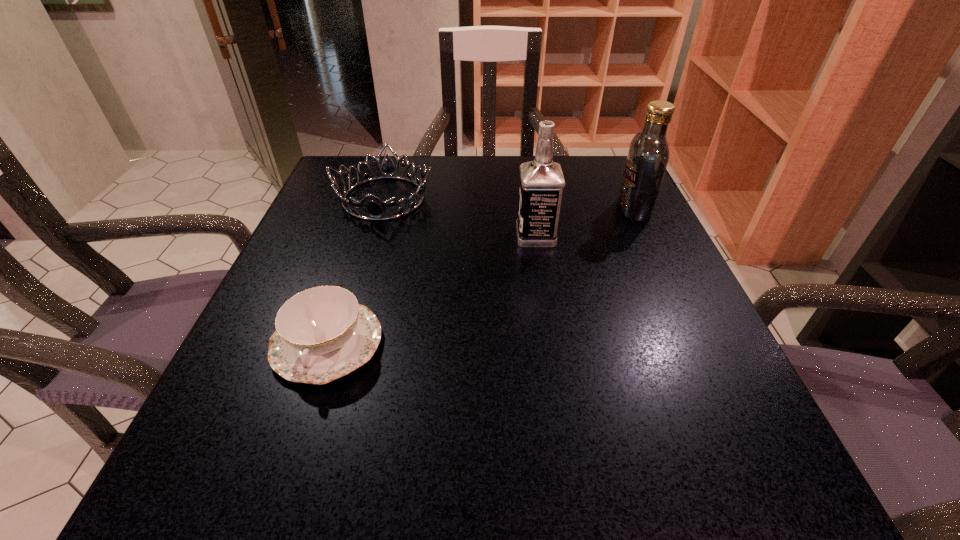
Locate an element on the screen. Image resolution: width=960 pixels, height=540 pixels. the left vodka is located at coordinates (541, 183).

This screenshot has height=540, width=960. What are the coordinates of `the nearer vodka` in the screenshot? It's located at (541, 183).

In order to click on the rightmost object in this screenshot , I will do `click(648, 156)`.

Find the location of a particular element. the right vodka is located at coordinates (648, 156).

This screenshot has height=540, width=960. What are the coordinates of `tiara` in the screenshot? It's located at (376, 213).

You are a GUI agent. You are given a task and a screenshot of the screen. Output one action in this format:
    pyautogui.click(x=<x>, y=<y>)
    Task: Click on the shortest object
    
    Given the screenshot: What is the action you would take?
    pyautogui.click(x=322, y=333)

Locate an element on the screen. The height and width of the screenshot is (540, 960). the nearest object is located at coordinates (322, 333).

Where is `blank space located 0.150m on the front label of the nearer vodka`? This screenshot has height=540, width=960. blank space located 0.150m on the front label of the nearer vodka is located at coordinates (443, 236).

Where is `free space located on the front label of the nearer vodka`? The height and width of the screenshot is (540, 960). free space located on the front label of the nearer vodka is located at coordinates (369, 236).

Identify the location of free space located on the front label of the nearer vodka. coord(398,236).